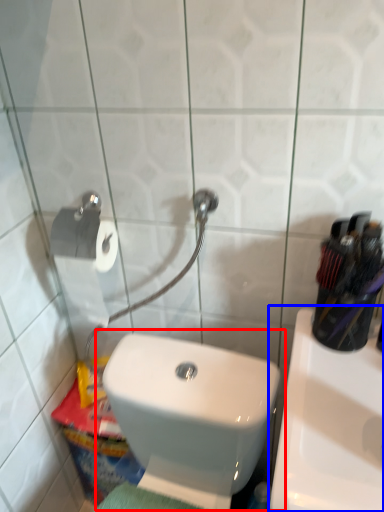
Question: Among these objects, which one is farthest to the camera, toilet (highlighted by a red box) or sink (highlighted by a blue box)?

Choices:
 (A) toilet
 (B) sink

Answer: (B)